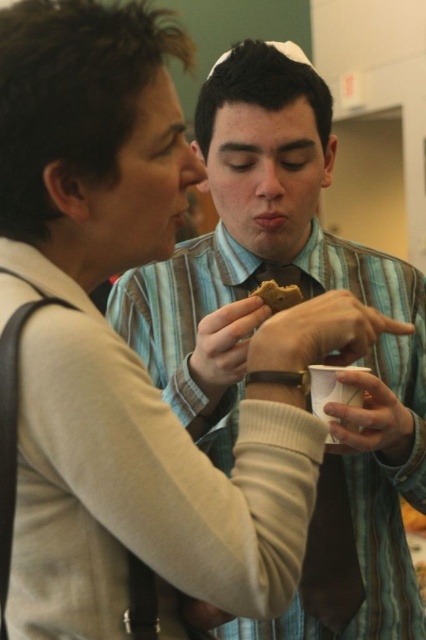
Question: Can you confirm if matte brown tie at center is positioned to the left of brown crumbly cookie at center?

Choices:
 (A) yes
 (B) no

Answer: (B)

Question: Is matte brown tie at center in front of brown crumbly cookie at center?

Choices:
 (A) no
 (B) yes

Answer: (B)

Question: Which point appears farthest from the camera in this image?

Choices:
 (A) (264, 285)
 (B) (389, 513)

Answer: (B)

Question: Which point is farther to the camera?

Choices:
 (A) (296, 291)
 (B) (278, 45)

Answer: (B)

Question: Does matte brown tie at center lie behind brown crumbly cookie at center?

Choices:
 (A) yes
 (B) no

Answer: (B)